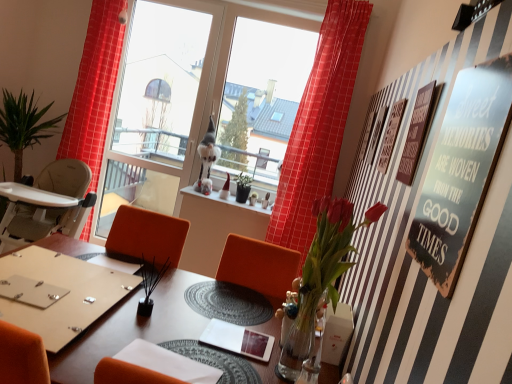
The image size is (512, 384). Describe the element at coordinates (63, 287) in the screenshot. I see `matte wooden table at center` at that location.

Identify the location of wooden table at center. (130, 329).

The height and width of the screenshot is (384, 512). Describe the element at coordinates (319, 125) in the screenshot. I see `red sheer curtain at upper center, arranged as the second curtain when viewed from the left` at that location.

What do you see at coordinates (94, 88) in the screenshot? The width and height of the screenshot is (512, 384). I see `red checkered curtain at left, which is counted as the first curtain, starting from the left` at bounding box center [94, 88].

In order to click on transparent glass window screen at center, positioned as the second window screen in left-to-right order in this screenshot , I will do `click(262, 95)`.

Where is `matte wooden table at center`? matte wooden table at center is located at coordinates (63, 287).

From a real-world perspective, is metallic silver sign at upper right, the 1th bulletin board positioned from the front, physically located above or below transparent glass window screen at center, positioned as the second window screen in left-to-right order?

From a real-world perspective, metallic silver sign at upper right, the 1th bulletin board positioned from the front, is physically below transparent glass window screen at center, positioned as the second window screen in left-to-right order.

From the picture: Considering the relative sizes of metallic silver sign at upper right, the 1th bulletin board positioned from the front, and transparent glass window screen at center, which appears as the first window screen when viewed from the right, in the image provided, is metallic silver sign at upper right, the 1th bulletin board positioned from the front, shorter than transparent glass window screen at center, which appears as the first window screen when viewed from the right,?

Yes, metallic silver sign at upper right, the 1th bulletin board positioned from the front, is shorter than transparent glass window screen at center, which appears as the first window screen when viewed from the right.

Between point (500, 125) and point (277, 136), which one is positioned behind?

Point (277, 136)

Can you confirm if metallic silver sign at upper right, which appears as the second bulletin board when viewed from the back, is positioned to the left of matte wooden table at center?

No.

Between metallic silver sign at upper right, which appears as the second bulletin board when viewed from the back, and matte wooden table at center, which one has more height?

With more height is metallic silver sign at upper right, which appears as the second bulletin board when viewed from the back.

Can you tell me how much metallic silver sign at upper right, the 1th bulletin board positioned from the front, and matte wooden table at center differ in facing direction?

There is a 88.4-degree angle between the facing directions of metallic silver sign at upper right, the 1th bulletin board positioned from the front, and matte wooden table at center.

From a real-world perspective, between metallic silver sign at upper right, the 1th bulletin board positioned from the front, and matte wooden table at center, who is vertically higher?

In real-world perspective, metallic silver sign at upper right, the 1th bulletin board positioned from the front, is above.

Who is smaller, wooden table at center or transparent glass window at center, the second window screen positioned from the right?

Smaller between the two is transparent glass window at center, the second window screen positioned from the right.

Is wooden table at center outside of transparent glass window at center, the second window screen positioned from the right?

Yes.

Which is behind, point (53, 373) or point (186, 108)?

Positioned behind is point (186, 108).

Can you tell me how much wooden table at center and transparent glass window at center, which is counted as the first window screen, starting from the left, differ in facing direction?

90.6 degrees separate the facing orientations of wooden table at center and transparent glass window at center, which is counted as the first window screen, starting from the left.

Image resolution: width=512 pixels, height=384 pixels. Find the location of `table directly beneath the red checkered curtain at left, acting as the 2th curtain starting from the right (from a real-world perspective)`. table directly beneath the red checkered curtain at left, acting as the 2th curtain starting from the right (from a real-world perspective) is located at coordinates (130, 329).

Does wooden table at center have a lesser height compared to red checkered curtain at left, acting as the 2th curtain starting from the right?

Yes, wooden table at center is shorter than red checkered curtain at left, acting as the 2th curtain starting from the right.

Based on their positions, is wooden table at center located to the left or right of red checkered curtain at left, which is counted as the first curtain, starting from the left?

wooden table at center is to the right of red checkered curtain at left, which is counted as the first curtain, starting from the left.

Which is nearer, [146,330] or [90,140]?

Point [146,330] is positioned closer to the camera compared to point [90,140].

Between wooden plaque at upper right, which ranks as the second bulletin board in front-to-back order, and transparent glass window screen at center, positioned as the second window screen in left-to-right order, which one is positioned in front?

Positioned in front is wooden plaque at upper right, which ranks as the second bulletin board in front-to-back order.

From the image's perspective, is wooden plaque at upper right, which is counted as the 1th bulletin board, starting from the back, beneath transparent glass window screen at center, positioned as the second window screen in left-to-right order?

Yes, from the image's perspective, wooden plaque at upper right, which is counted as the 1th bulletin board, starting from the back, is beneath transparent glass window screen at center, positioned as the second window screen in left-to-right order.

Can you confirm if wooden plaque at upper right, which is counted as the 1th bulletin board, starting from the back, is positioned to the left of transparent glass window screen at center, positioned as the second window screen in left-to-right order?

No.

From a real-world perspective, is transparent glass window at center, which is counted as the first window screen, starting from the left, located higher than wooden table at center?

Yes, from a real-world perspective, transparent glass window at center, which is counted as the first window screen, starting from the left, is on top of wooden table at center.

Can we say transparent glass window at center, which is counted as the first window screen, starting from the left, lies outside wooden table at center?

Indeed, transparent glass window at center, which is counted as the first window screen, starting from the left, is completely outside wooden table at center.

Considering the positions of points (169, 197) and (186, 316), is point (169, 197) closer to camera compared to point (186, 316)?

No, it is not.

From a real-world perspective, is wooden plaque at upper right, which ranks as the second bulletin board in front-to-back order, over translucent glass vase at center-right?

Yes, from a real-world perspective, wooden plaque at upper right, which ranks as the second bulletin board in front-to-back order, is over translucent glass vase at center-right

Find the location of `plant that is on the left side of wooden plaque at upper right, which ranks as the second bulletin board in front-to-back order`. plant that is on the left side of wooden plaque at upper right, which ranks as the second bulletin board in front-to-back order is located at coordinates pyautogui.click(x=321, y=276).

Is wooden plaque at upper right, which ranks as the second bulletin board in front-to-back order, positioned with its back to translucent glass vase at center-right?

Yes.

From the image's perspective, count 2nd window screens upward from the metallic silver sign at upper right, which appears as the second bulletin board when viewed from the back, and point to it. Please provide its 2D coordinates.

[(262, 95)]

You are a GUI agent. You are given a task and a screenshot of the screen. Output one action in this format:
    pyautogui.click(x=<x>, y=<y>)
    Task: Click on the 2nd bulletin board positioned above the matte wooden table at center (from a real-world perspective)
    
    Given the screenshot: What is the action you would take?
    pyautogui.click(x=461, y=170)

Estimate the real-world distances between objects in this image. Which object is closer to transparent glass window screen at center, which appears as the first window screen when viewed from the right, transparent glass window at center, which is counted as the first window screen, starting from the left, or translucent glass vase at center-right?

Among the two, transparent glass window at center, which is counted as the first window screen, starting from the left, is located nearer to transparent glass window screen at center, which appears as the first window screen when viewed from the right.

Looking at the image, which one is located closer to wooden plaque at upper right, which ranks as the second bulletin board in front-to-back order, transparent glass window at center, which is counted as the first window screen, starting from the left, or red checkered curtain at left, acting as the 2th curtain starting from the right?

Among the two, red checkered curtain at left, acting as the 2th curtain starting from the right, is located nearer to wooden plaque at upper right, which ranks as the second bulletin board in front-to-back order.

Considering their positions, is transparent glass window screen at center, which appears as the first window screen when viewed from the right, positioned closer to wooden plaque at upper right, which ranks as the second bulletin board in front-to-back order, than translucent glass vase at center-right?

Based on the image, translucent glass vase at center-right appears to be nearer to wooden plaque at upper right, which ranks as the second bulletin board in front-to-back order.

When comparing their distances from wooden table at center, does metallic silver sign at upper right, which appears as the second bulletin board when viewed from the back, or red checkered curtain at left, acting as the 2th curtain starting from the right, seem closer?

metallic silver sign at upper right, which appears as the second bulletin board when viewed from the back.

Estimate the real-world distances between objects in this image. Which object is further from matte wooden table at center, wooden plaque at upper right, which is counted as the 1th bulletin board, starting from the back, or translucent glass vase at center-right?

wooden plaque at upper right, which is counted as the 1th bulletin board, starting from the back, lies further to matte wooden table at center than the other object.

Based on their spatial positions, is metallic silver sign at upper right, which appears as the second bulletin board when viewed from the back, or matte wooden table at center closer to translucent glass vase at center-right?

The object closer to translucent glass vase at center-right is metallic silver sign at upper right, which appears as the second bulletin board when viewed from the back.

Estimate the real-world distances between objects in this image. Which object is closer to wooden plaque at upper right, which ranks as the second bulletin board in front-to-back order, wooden table at center or transparent glass window screen at center, which appears as the first window screen when viewed from the right?

wooden table at center is positioned closer to the anchor wooden plaque at upper right, which ranks as the second bulletin board in front-to-back order.

Considering their positions, is translucent glass vase at center-right positioned further to matte wooden table at center than metallic silver sign at upper right, which appears as the second bulletin board when viewed from the back?

metallic silver sign at upper right, which appears as the second bulletin board when viewed from the back, is positioned further to the anchor matte wooden table at center.

Find the location of a particular element. Image resolution: width=512 pixels, height=384 pixels. round table between wooden plaque at upper right, which ranks as the second bulletin board in front-to-back order, and red sheer curtain at upper center, the 1th curtain in the right-to-left sequence, along the z-axis is located at coordinates (63, 287).

Find the location of a particular element. The height and width of the screenshot is (384, 512). bulletin board between wooden table at center and transparent glass window at center, the second window screen positioned from the right, along the z-axis is located at coordinates (415, 261).

Identify the location of plant between wooden table at center and transparent glass window screen at center, positioned as the second window screen in left-to-right order, in the front-back direction. This screenshot has height=384, width=512. (321, 276).

This screenshot has width=512, height=384. I want to click on table between matte wooden table at center and translucent glass vase at center-right, so click(x=130, y=329).